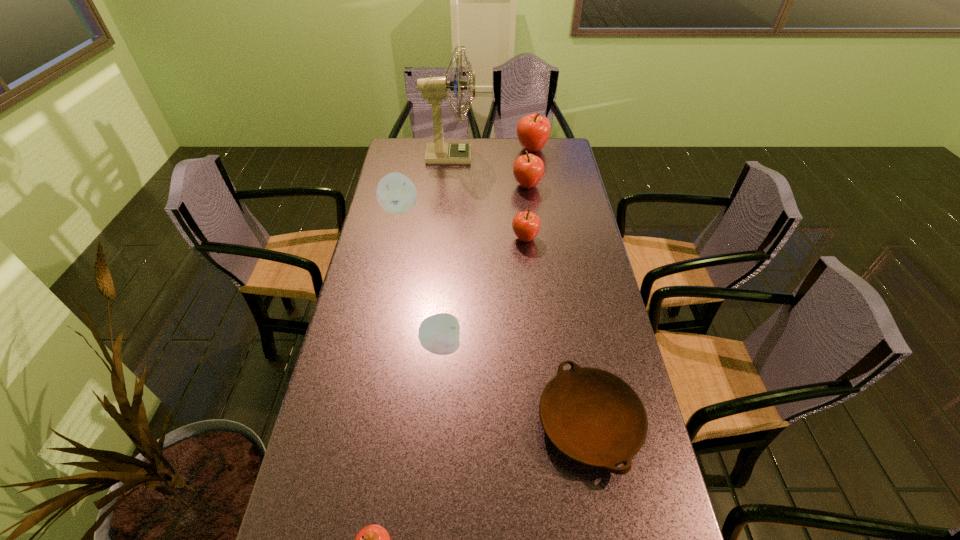
Image resolution: width=960 pixels, height=540 pixels. What are the coordinates of `fan` in the screenshot? It's located at (435, 89).

The image size is (960, 540). I want to click on the tallest object, so click(x=435, y=89).

Find the location of a particular element. the biggest pink apple is located at coordinates (533, 131).

Identify the location of the tallest apple. (533, 131).

Where is `the farther white apple`? the farther white apple is located at coordinates (396, 193).

Locate an element on the screen. the bigger white apple is located at coordinates (396, 193).

Where is `the sixth nearest object`? the sixth nearest object is located at coordinates (528, 169).

At what (x,y) coordinates should I click in order to perform the action: click on the second farthest pink apple. Please return your answer as a coordinate pair (x, y). Looking at the image, I should click on (528, 169).

This screenshot has height=540, width=960. What are the coordinates of `the third farthest pink apple` in the screenshot? It's located at (526, 225).

Locate an element on the screen. Image resolution: width=960 pixels, height=540 pixels. the fourth nearest object is located at coordinates (526, 225).